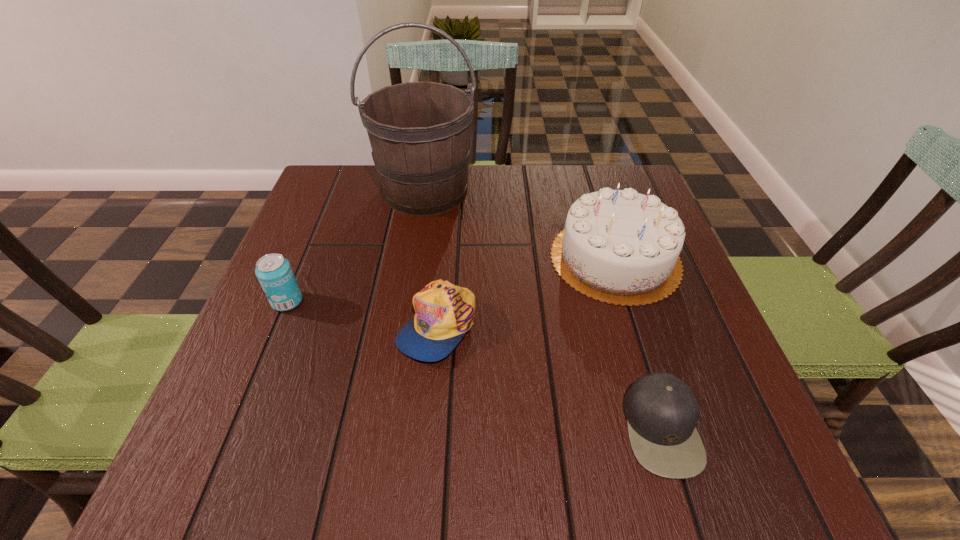
This screenshot has width=960, height=540. I want to click on object present at the far left corner, so click(419, 132).

Locate an element on the screen. This screenshot has width=960, height=540. object at the near right corner is located at coordinates (662, 411).

Where is `vacant space at the far edge of the desktop`? This screenshot has width=960, height=540. vacant space at the far edge of the desktop is located at coordinates (564, 180).

At what (x,y) coordinates should I click in order to perform the action: click on vacant region at the near edge of the desktop. Please return your answer as a coordinate pair (x, y). Looking at the image, I should click on (643, 487).

Where is `free space at the left edge of the desktop`? The image size is (960, 540). free space at the left edge of the desktop is located at coordinates coord(292,259).

You are a GUI agent. You are given a task and a screenshot of the screen. Output one action in this format:
    pyautogui.click(x=<x>, y=<y>)
    Task: Click on the vacant space at the right edge
    The width and height of the screenshot is (960, 540).
    Given the screenshot: What is the action you would take?
    pyautogui.click(x=729, y=399)

Find the location of `vacant space at the far left corner of the desktop`. vacant space at the far left corner of the desktop is located at coordinates (316, 198).

Locate an element on the screen. The height and width of the screenshot is (540, 960). vacant space at the near left corner of the desktop is located at coordinates (226, 450).

Where is `free space at the near right corner`? The height and width of the screenshot is (540, 960). free space at the near right corner is located at coordinates (709, 465).

At what (x,y) coordinates should I click in order to perform the action: click on vacant space that's between the bucket and the farther cap. Please return your answer as a coordinate pair (x, y). Looking at the image, I should click on (431, 258).